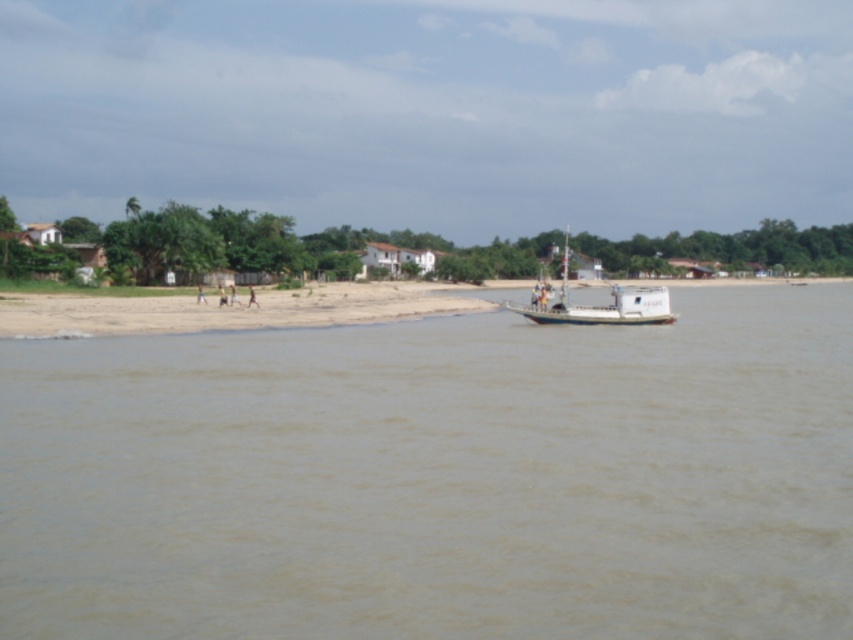
Can you confirm if brown muddy water at center is bigger than white matte boat at center?

Actually, brown muddy water at center might be smaller than white matte boat at center.

At what (x,y) coordinates should I click in order to perform the action: click on brown muddy water at center. Please return your answer as a coordinate pair (x, y). Looking at the image, I should click on [x=437, y=477].

The image size is (853, 640). Describe the element at coordinates (437, 477) in the screenshot. I see `brown muddy water at center` at that location.

Identify the location of brown muddy water at center. (437, 477).